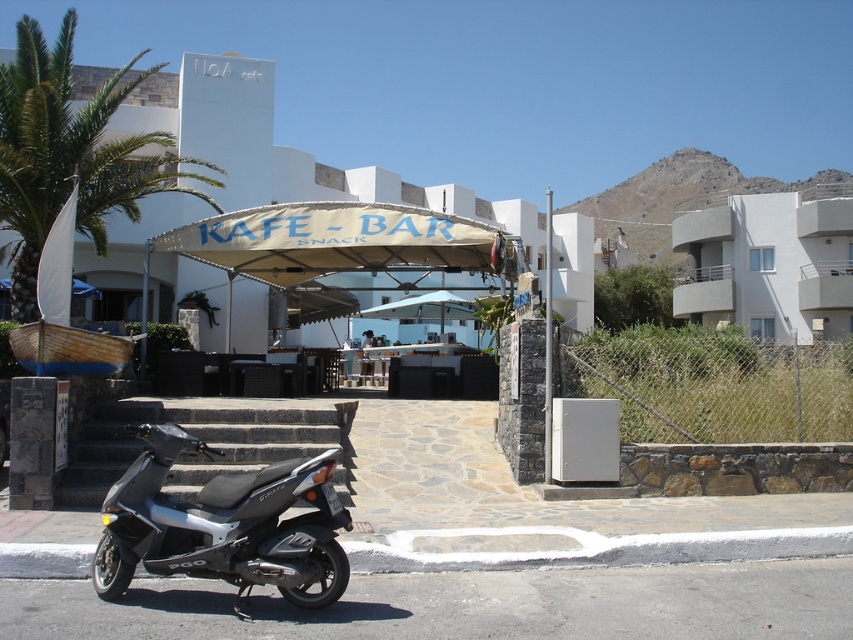
Is point (199, 138) positioned behind point (846, 269)?

No, it is in front of (846, 269).

Who is more forward, [317,170] or [840,266]?

Point [317,170] is in front.

Identify the location of white matte building at center. (289, 150).

Does white matte building at center have a greater height compared to green leafy palm tree at upper left?

In fact, white matte building at center may be shorter than green leafy palm tree at upper left.

Measure the distance between white matte building at center and green leafy palm tree at upper left.

They are 39.26 feet apart.

What do you see at coordinates (289, 150) in the screenshot? This screenshot has width=853, height=640. I see `white matte building at center` at bounding box center [289, 150].

What are the coordinates of `white matte building at center` in the screenshot? It's located at (289, 150).

Does white matte building at center appear over silver metallic scooter at lower left?

Yes.

Can you confirm if white matte building at center is bigger than silver metallic scooter at lower left?

Indeed, white matte building at center has a larger size compared to silver metallic scooter at lower left.

Identify the location of white matte building at center. Image resolution: width=853 pixels, height=640 pixels. (289, 150).